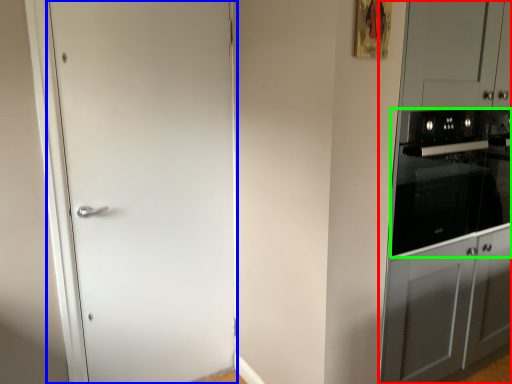
Question: Which object is the closest to the dresser (highlighted by a red box)? Choose among these: door (highlighted by a blue box) or home appliance (highlighted by a green box).

Choices:
 (A) door
 (B) home appliance

Answer: (B)